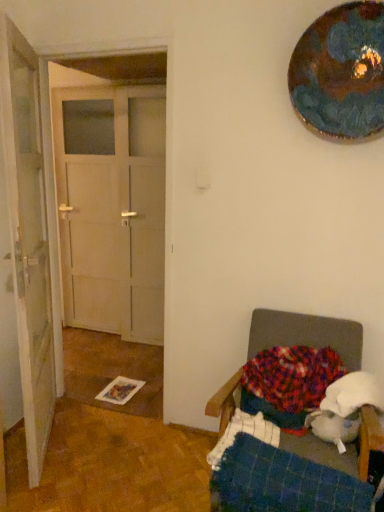
Question: Considering the relative positions of multicolored knitted blanket at lower right and white matte door at left, which is the 1th door from right to left, in the image provided, is multicolored knitted blanket at lower right to the left or to the right of white matte door at left, which is the 1th door from right to left,?

Choices:
 (A) right
 (B) left

Answer: (A)

Question: From the image's perspective, is multicolored knitted blanket at lower right above or below white matte door at left, the second door viewed from the left?

Choices:
 (A) above
 (B) below

Answer: (B)

Question: Considering the real-world distances, which object is closest to the blue plaid blanket at lower right?

Choices:
 (A) multicolored knitted blanket at lower right
 (B) white matte door at left, which is the 1th door from right to left
 (C) metallic reflective plate at upper right
 (D) white wooden door at left, the second door in the right-to-left sequence
 (E) plush fabric chair at lower right

Answer: (E)

Question: Which object is positioned closest to the metallic reflective plate at upper right?

Choices:
 (A) plush fabric chair at lower right
 (B) multicolored knitted blanket at lower right
 (C) white matte door at left, the second door viewed from the left
 (D) white wooden door at left, acting as the 1th door starting from the left
 (E) blue plaid blanket at lower right

Answer: (A)